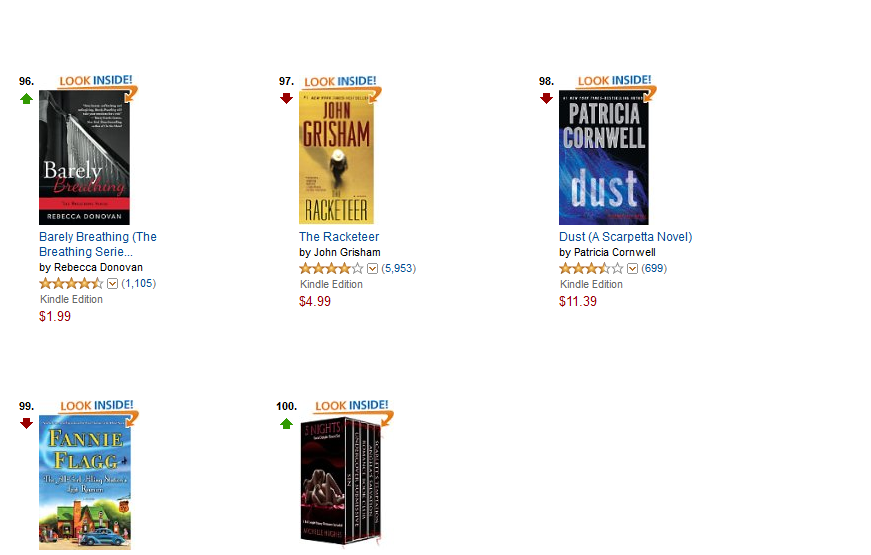
Locate an element on the screen. This screenshot has width=871, height=555. books is located at coordinates (78, 148), (314, 161), (602, 168), (329, 468), (64, 473), (356, 491), (367, 496), (377, 474), (370, 483).